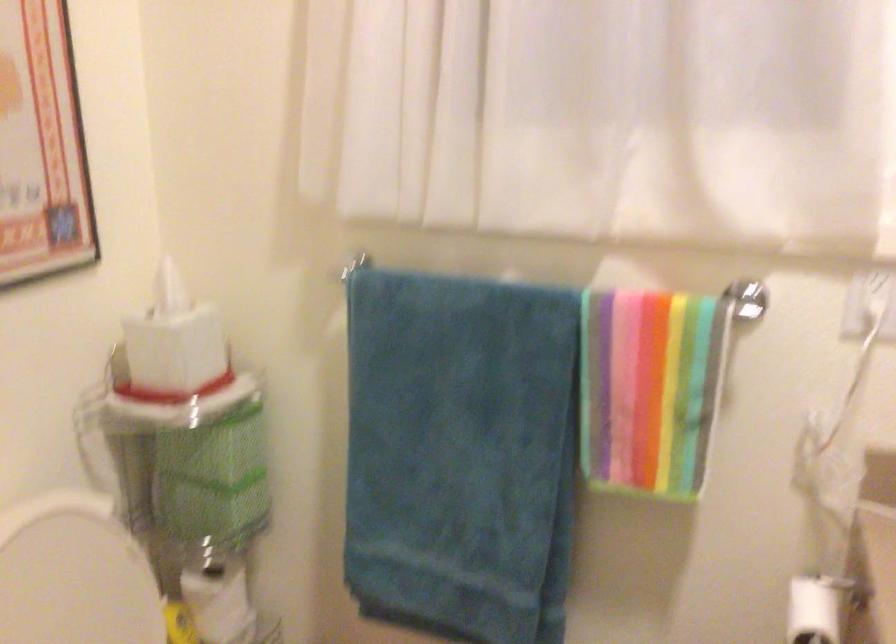
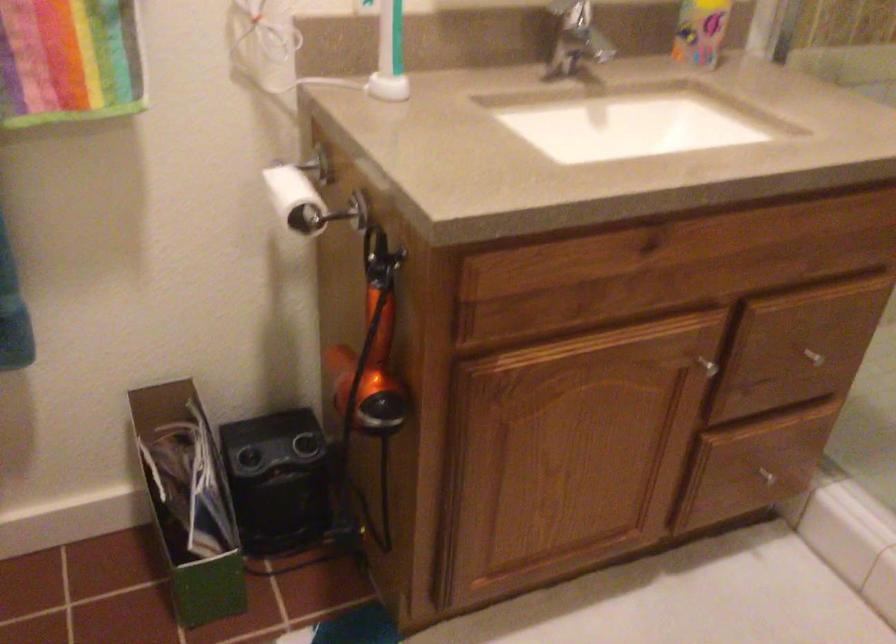
The first image is from the beginning of the video and the second image is from the end. How did the camera likely rotate when shooting the video?

The camera's rotation is toward right-down.